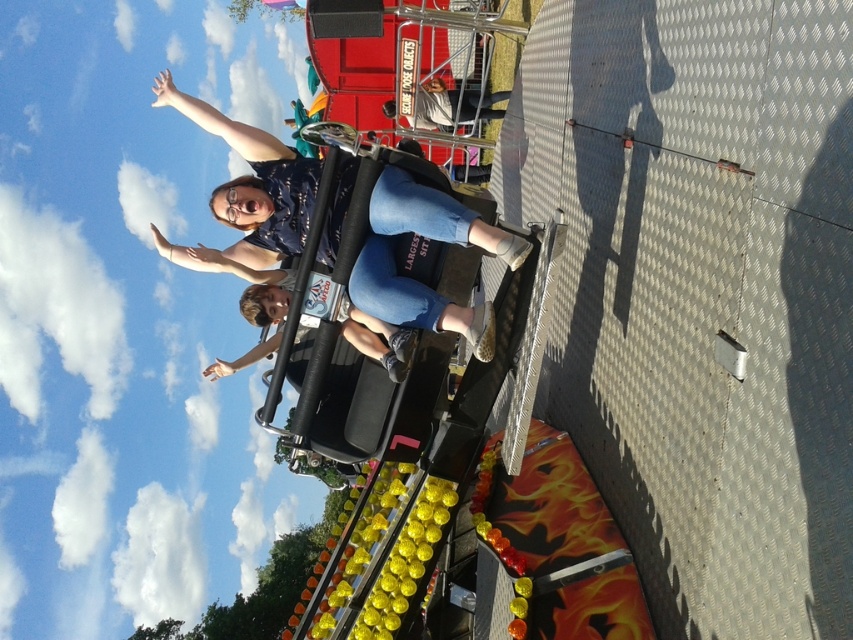
Which is above, light brown leather jacket at center or matte black helmet at upper center?

matte black helmet at upper center is higher up.

Can you confirm if light brown leather jacket at center is positioned to the right of matte black helmet at upper center?

In fact, light brown leather jacket at center is to the left of matte black helmet at upper center.

Image resolution: width=853 pixels, height=640 pixels. I want to click on light brown leather jacket at center, so click(x=259, y=316).

Looking at this image, can you confirm if denim jeans at center is smaller than light brown leather jacket at center?

No, denim jeans at center is not smaller than light brown leather jacket at center.

You are a GUI agent. You are given a task and a screenshot of the screen. Output one action in this format:
    pyautogui.click(x=<x>, y=<y>)
    Task: Click on the denim jeans at center
    This screenshot has height=640, width=853.
    Given the screenshot: What is the action you would take?
    pyautogui.click(x=415, y=280)

From the picture: Does denim jeans at center have a lesser height compared to matte black helmet at upper center?

No.

Can you confirm if denim jeans at center is taller than matte black helmet at upper center?

Yes.

Is point (434, 294) positioned behind point (479, 112)?

No, (434, 294) is in front of (479, 112).

This screenshot has height=640, width=853. Find the location of `denim jeans at center`. denim jeans at center is located at coordinates (415, 280).